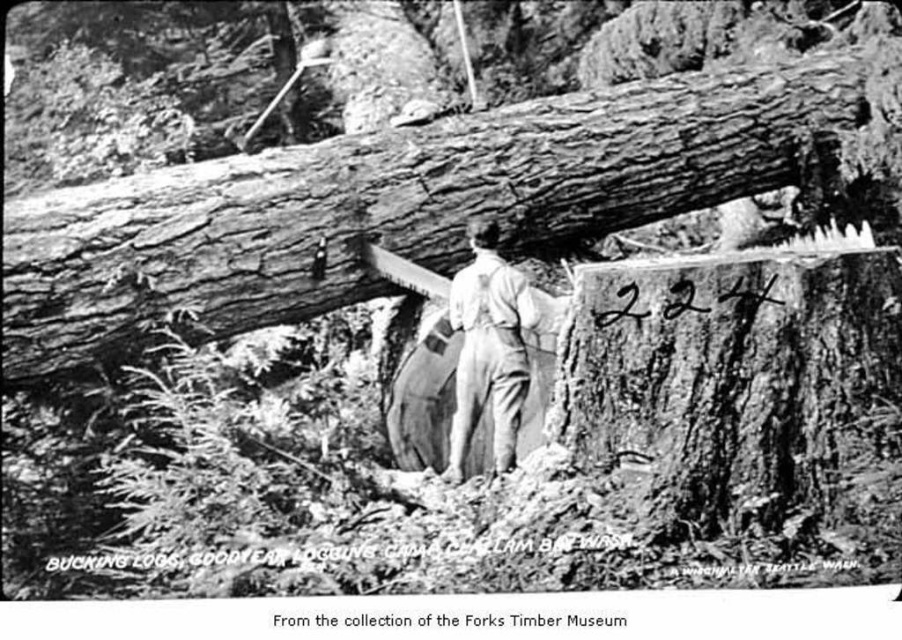
Looking at this image, can you confirm if rough bark log at center is taller than light gray overalls at center?

Indeed, rough bark log at center has a greater height compared to light gray overalls at center.

Is rough bark log at center wider than light gray overalls at center?

Yes.

Is point (557, 147) closer to viewer compared to point (523, 316)?

That is False.

Locate an element on the screen. The width and height of the screenshot is (902, 640). rough bark log at center is located at coordinates (394, 202).